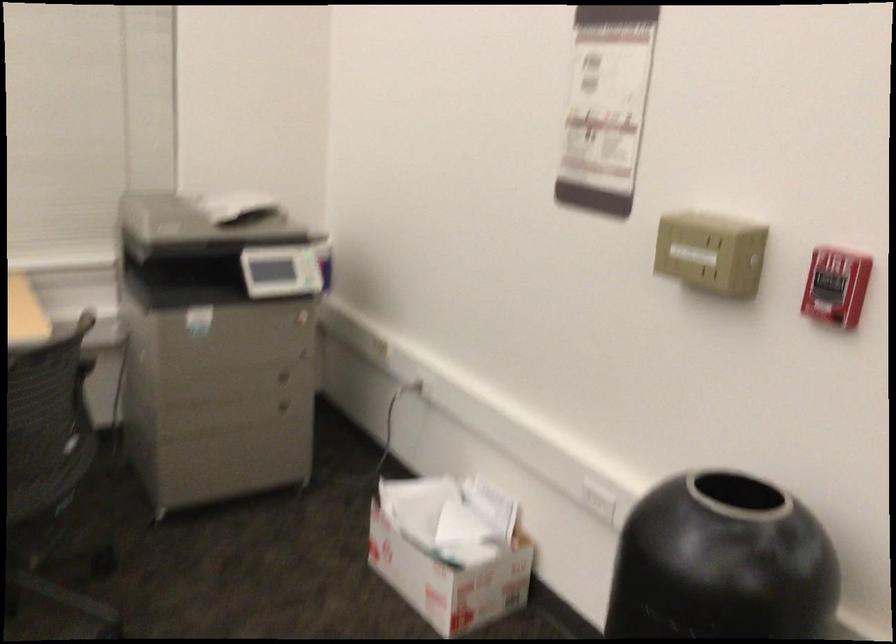
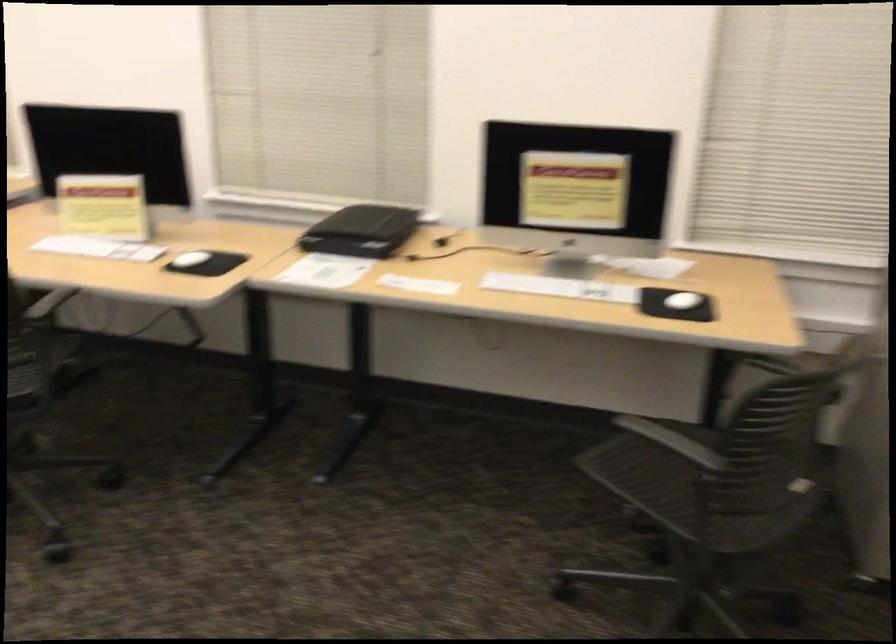
Question: The camera is either moving clockwise (left) or counter-clockwise (right) around the object. The first image is from the beginning of the video and the second image is from the end. Is the camera moving left or right when shooting the video?

Choices:
 (A) Left
 (B) Right

Answer: (B)